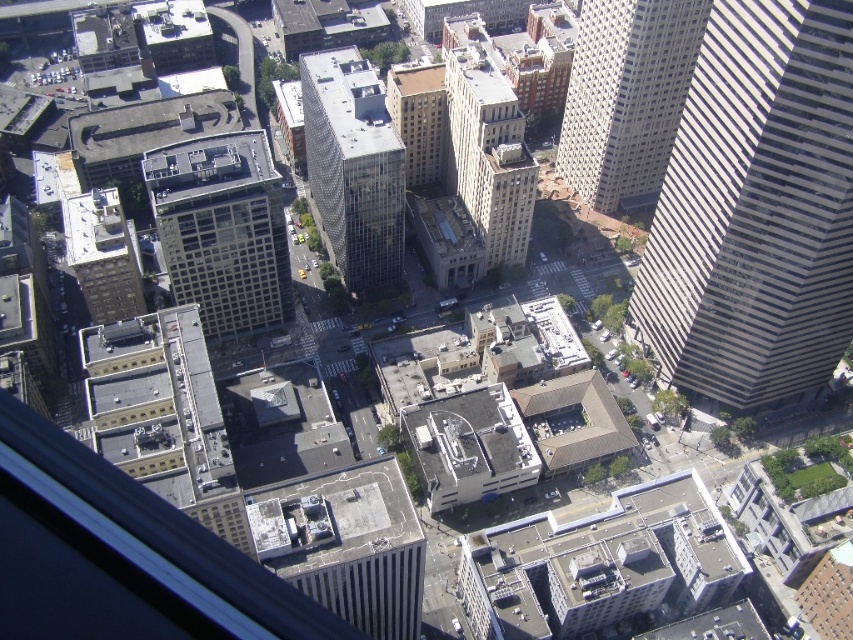
You are an urban planner analyzing the city layout. You notice two skyscrapers at the center of the scene. Which one has a greater width between the matte glass skyscraper at center and the clear glass skyscraper at center?

The matte glass skyscraper at center has a greater width than the clear glass skyscraper at center according to the description.

You are a city planner analyzing the aerial view of the urban area. You notice two brown buildings at the center of the image. The brown brick building at center and the brown glass building at center. You need to install a new traffic light between them. The traffic light requires a minimum of 20 inches of clearance on all sides. Can the traffic light be placed between them?

The brown brick building at center and the brown glass building at center are 25.40 inches apart. Since the traffic light requires 20 inches of clearance on all sides, the total required space would be 20 inches x 2 sides, totaling 40 inches. However, the distance between the two buildings is only 25.40 inches, which is less than the required 40 inches. Therefore, the traffic light cannot be placed between them.